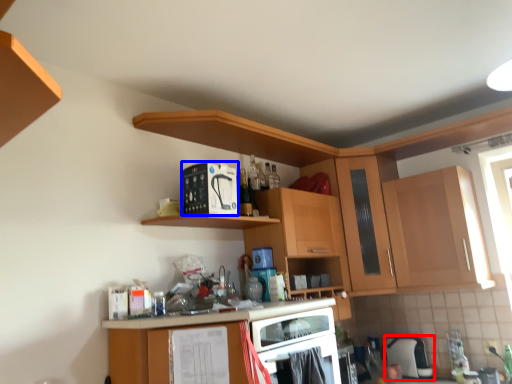
Question: Which object is further to the camera taking this photo, appliance (highlighted by a red box) or appliance (highlighted by a blue box)?

Choices:
 (A) appliance
 (B) appliance

Answer: (A)